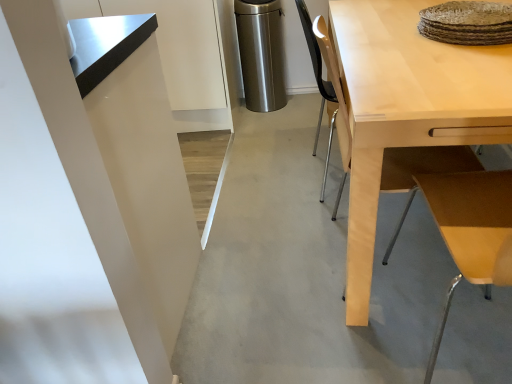
Question: Does light wood table at upper right have a lesser height compared to stainless steel trash can at center?

Choices:
 (A) yes
 (B) no

Answer: (B)

Question: From the image's perspective, is light wood table at upper right above stainless steel trash can at center?

Choices:
 (A) yes
 (B) no

Answer: (B)

Question: Is light wood table at upper right not within stainless steel trash can at center?

Choices:
 (A) yes
 (B) no

Answer: (A)

Question: From the image's perspective, is light wood table at upper right below stainless steel trash can at center?

Choices:
 (A) no
 (B) yes

Answer: (B)

Question: From a real-world perspective, is light wood table at upper right located higher than stainless steel trash can at center?

Choices:
 (A) yes
 (B) no

Answer: (A)

Question: Considering the positions of point [x=458, y=188] and point [x=395, y=8], is point [x=458, y=188] closer or farther from the camera than point [x=395, y=8]?

Choices:
 (A) closer
 (B) farther

Answer: (A)

Question: Considering the relative positions of light wood table at upper right and light wood desk at right in the image provided, is light wood table at upper right to the left or to the right of light wood desk at right?

Choices:
 (A) left
 (B) right

Answer: (A)

Question: Based on their sizes in the image, would you say light wood table at upper right is bigger or smaller than light wood desk at right?

Choices:
 (A) small
 (B) big

Answer: (A)

Question: From a real-world perspective, is light wood table at upper right physically located above or below light wood desk at right?

Choices:
 (A) below
 (B) above

Answer: (B)

Question: Considering the positions of light wood table at upper right and stainless steel trash can at center in the image, is light wood table at upper right bigger or smaller than stainless steel trash can at center?

Choices:
 (A) small
 (B) big

Answer: (B)

Question: Would you say light wood table at upper right is to the left or to the right of stainless steel trash can at center in the picture?

Choices:
 (A) left
 (B) right

Answer: (B)

Question: Do you think light wood table at upper right is within stainless steel trash can at center, or outside of it?

Choices:
 (A) outside
 (B) inside

Answer: (A)

Question: Relative to stainless steel trash can at center, is light wood table at upper right in front or behind?

Choices:
 (A) front
 (B) behind

Answer: (A)

Question: In terms of size, does light wood desk at right appear bigger or smaller than stainless steel trash can at center?

Choices:
 (A) small
 (B) big

Answer: (B)

Question: Is light wood desk at right taller or shorter than stainless steel trash can at center?

Choices:
 (A) short
 (B) tall

Answer: (B)